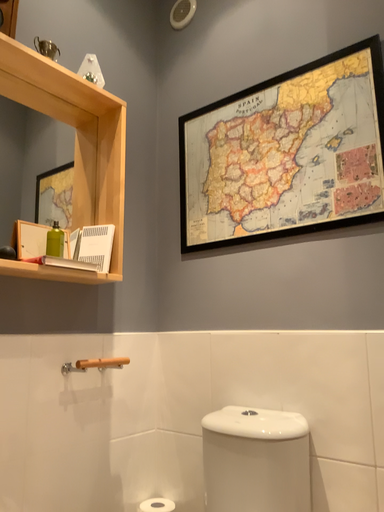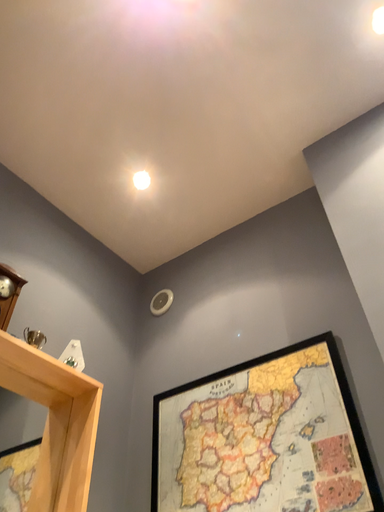
Question: Which way did the camera rotate in the video?

Choices:
 (A) rotated downward
 (B) rotated upward

Answer: (B)